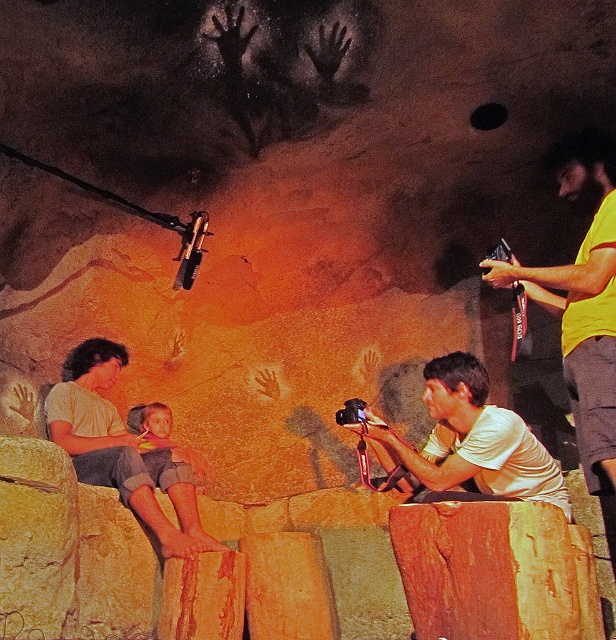
Question: Does yellow fabric shirt at upper right appear under matte white shirt at center?

Choices:
 (A) no
 (B) yes

Answer: (A)

Question: Which object is farther from the camera taking this photo?

Choices:
 (A) matte yellow shirt at left
 (B) yellow fabric shirt at upper right
 (C) matte white shirt at center

Answer: (A)

Question: Can you confirm if yellow fabric shirt at upper right is thinner than matte white shirt at center?

Choices:
 (A) yes
 (B) no

Answer: (A)

Question: Among these objects, which one is farthest from the camera?

Choices:
 (A) matte white shirt at center
 (B) matte yellow shirt at left

Answer: (B)

Question: Which point is closer to the camera taking this photo?

Choices:
 (A) (586, 413)
 (B) (471, 368)

Answer: (A)

Question: Is matte white shirt at center wider than matte yellow shirt at left?

Choices:
 (A) yes
 (B) no

Answer: (B)